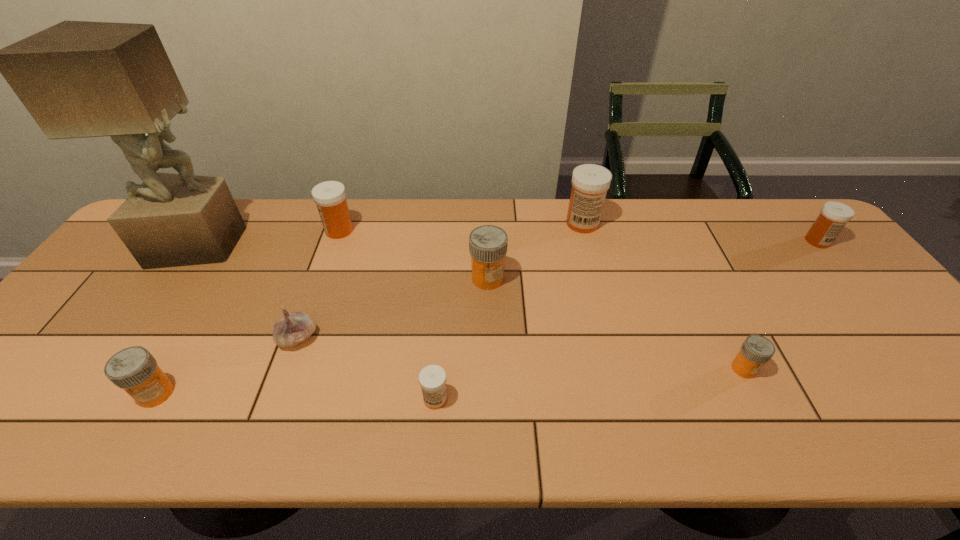
At what (x,y) coordinates should I click in order to perform the action: click on white medicine that stands as the third closest to the fifth object from right to left. Please return your answer as a coordinate pair (x, y). The width and height of the screenshot is (960, 540). Looking at the image, I should click on (834, 215).

Point out which white medicine is positioned as the nearest to the leftmost orange medicine. Please provide its 2D coordinates. Your answer should be formatted as a tuple, i.e. [(x, y)], where the tuple contains the x and y coordinates of a point satisfying the conditions above.

[(330, 196)]

The image size is (960, 540). Find the location of `orange medicine that is the closest to the sculpture`. orange medicine that is the closest to the sculpture is located at coordinates (133, 369).

Where is `orange medicine that is the closest to the rightmost orange medicine`? This screenshot has height=540, width=960. orange medicine that is the closest to the rightmost orange medicine is located at coordinates (488, 244).

Locate an element on the screen. The image size is (960, 540). vacant space that satisfies the following two spatial constraints: 1. on the front-facing side of the white garlic; 2. on the left side of the gray sculpture is located at coordinates (137, 338).

Image resolution: width=960 pixels, height=540 pixels. In order to click on free location that satisfies the following two spatial constraints: 1. on the back side of the fifth medicine from right to left; 2. on the left side of the rightmost object in this screenshot , I will do `click(448, 241)`.

Locate an element on the screen. Image resolution: width=960 pixels, height=540 pixels. free space that satisfies the following two spatial constraints: 1. on the front-facing side of the nearest white medicine; 2. on the left side of the gray sculpture is located at coordinates (96, 399).